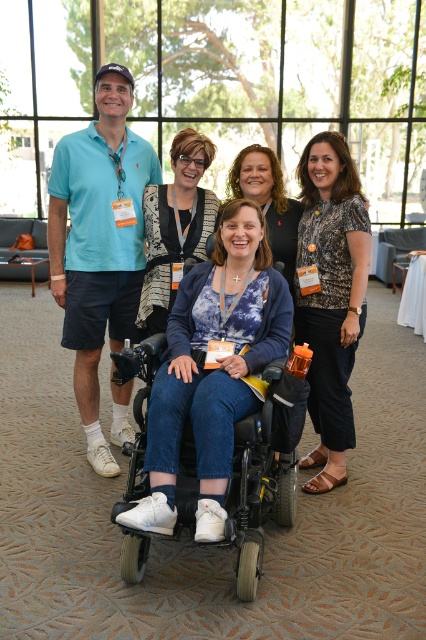
You are an event organizer who needs to ensure accessibility for attendees. You observe two wheelchairs in the scene. Which wheelchair, the white matte wheelchair at center or the black matte wheelchair at center, is more suitable for someone who requires a higher seating position?

The white matte wheelchair at center is taller than the black matte wheelchair at center, making it more suitable for someone who requires a higher seating position.

You are organizing a space for an event and need to place a new table in the room. The table requires a space larger than the black matte wheelchair at center. Can the matte black top at center be placed in that space without moving the wheelchair?

The black matte wheelchair at center is larger in size than the matte black top at center. Therefore, the space required for the table, which must be larger than the wheelchair, would also accommodate the matte black top at center without needing to move the wheelchair.